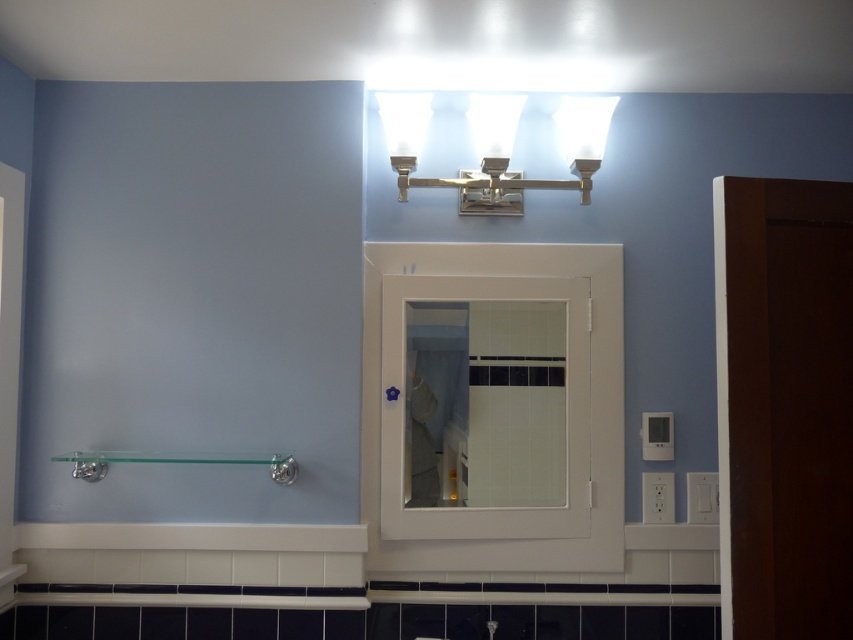
You are trying to hang a small hand towel on the clear glass towel bar at lower center and the matte silver faucet at lower center. Which object can you hang the towel on without it dragging on the floor?

The clear glass towel bar at lower center is much taller than the matte silver faucet at lower center, so you can hang the towel on the clear glass towel bar at lower center without it dragging on the floor.

You are a contractor measuring the bathroom wall. You see the white matte medicine cabinet at center and the matte silver faucet at lower center. Which object is taller?

The white matte medicine cabinet at center is taller than the matte silver faucet at lower center.

You are a bathroom designer arranging items. You have a white matte medicine cabinet at center and a clear glass towel bar at lower center. Which object is located to the right of the other?

The white matte medicine cabinet at center is positioned on the right side of the clear glass towel bar at lower center.